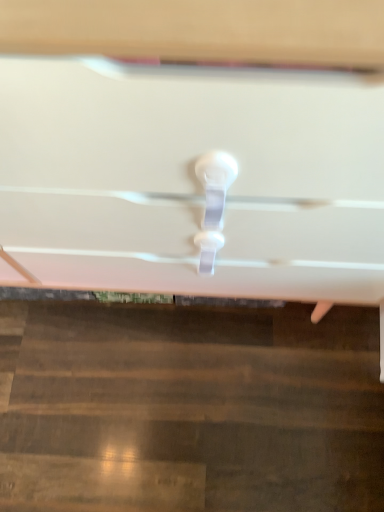
Question: Should I look upward or downward to see white plastic drawer handle at center?

Choices:
 (A) down
 (B) up

Answer: (B)